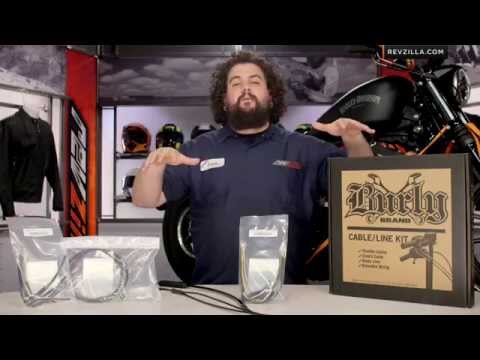
This screenshot has width=480, height=360. I want to click on tool on table, so click(175, 284).